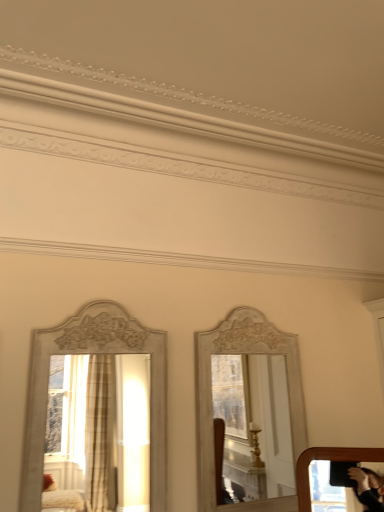
The height and width of the screenshot is (512, 384). Describe the element at coordinates (98, 433) in the screenshot. I see `white carved wood mirror at left` at that location.

Identify the location of white carved wood mirror at left. Image resolution: width=384 pixels, height=512 pixels. tap(98, 433).

Where is `white carved wood mirror at left`? Image resolution: width=384 pixels, height=512 pixels. white carved wood mirror at left is located at coordinates (98, 433).